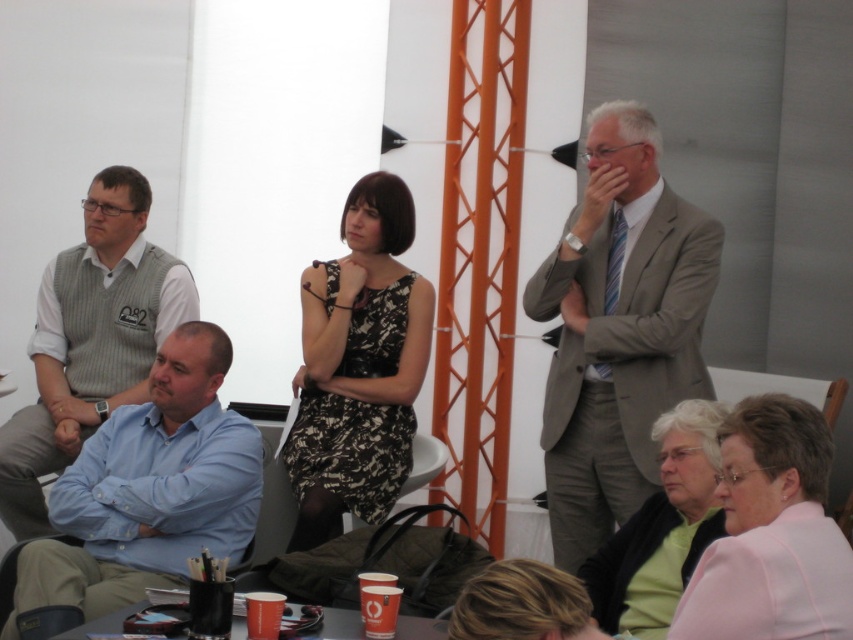
Is the position of black floral dress at center less distant than that of white plastic chair at center?

Yes, black floral dress at center is closer to the viewer.

Can you confirm if black floral dress at center is smaller than white plastic chair at center?

No, black floral dress at center is not smaller than white plastic chair at center.

Which is behind, point (383, 378) or point (347, 525)?

Positioned behind is point (347, 525).

Image resolution: width=853 pixels, height=640 pixels. What are the coordinates of `black floral dress at center` in the screenshot? It's located at (358, 365).

Can you confirm if black floral dress at center is bigger than black plastic table at lower center?

Yes, black floral dress at center is bigger than black plastic table at lower center.

Between black floral dress at center and black plastic table at lower center, which one is positioned lower?

black plastic table at lower center is below.

Who is more forward, (339, 492) or (337, 611)?

Point (337, 611)

Locate an element on the screen. Image resolution: width=853 pixels, height=640 pixels. black floral dress at center is located at coordinates (358, 365).

Between blue shirt at center and light green sweater at lower right, which one is positioned higher?

blue shirt at center is higher up.

How much distance is there between blue shirt at center and light green sweater at lower right?

blue shirt at center is 4.51 feet away from light green sweater at lower right.

Identify the location of blue shirt at center. The height and width of the screenshot is (640, 853). (149, 490).

Identify the location of blue shirt at center. This screenshot has width=853, height=640. (149, 490).